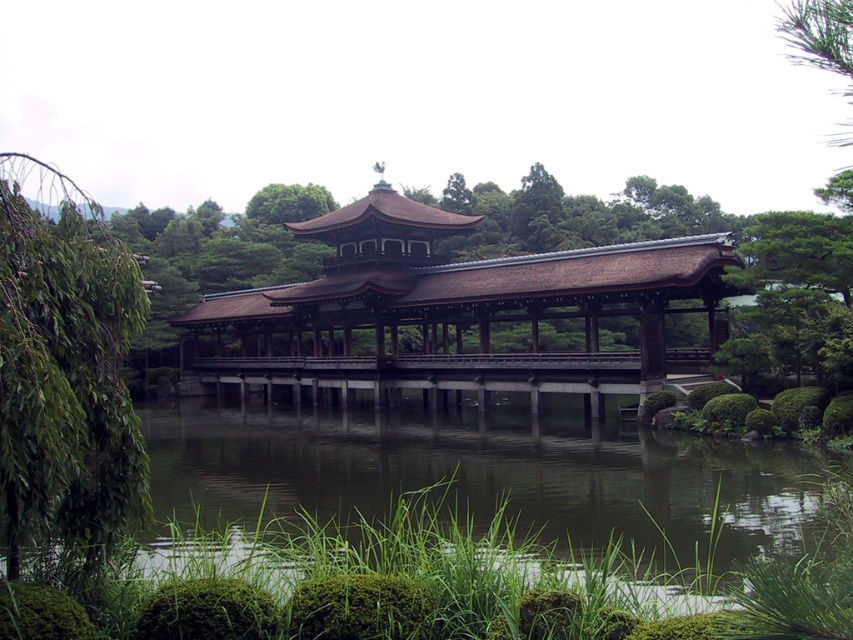
Does green leafy tree at left have a lesser height compared to brown wooden bridge at center?

Correct, green leafy tree at left is not as tall as brown wooden bridge at center.

Is point (30, 461) behind point (227, 380)?

No, (30, 461) is closer to viewer.

Find the location of a particular element. green leafy tree at left is located at coordinates (65, 376).

Which is more to the left, brown wooden gazebo at center or brown wooden bridge at center?

Positioned to the left is brown wooden bridge at center.

Does point (331, 310) lie in front of point (378, 404)?

That is False.

At what (x,y) coordinates should I click in order to perform the action: click on brown wooden gazebo at center. Please return your answer as a coordinate pair (x, y). This screenshot has width=853, height=640. Looking at the image, I should click on (451, 314).

Is brown wooden gazebo at center taller than green leafy tree at left?

Correct, brown wooden gazebo at center is much taller as green leafy tree at left.

Who is taller, brown wooden gazebo at center or green leafy tree at left?

brown wooden gazebo at center

What do you see at coordinates (451, 314) in the screenshot? The width and height of the screenshot is (853, 640). I see `brown wooden gazebo at center` at bounding box center [451, 314].

Image resolution: width=853 pixels, height=640 pixels. In order to click on brown wooden gazebo at center in this screenshot , I will do `click(451, 314)`.